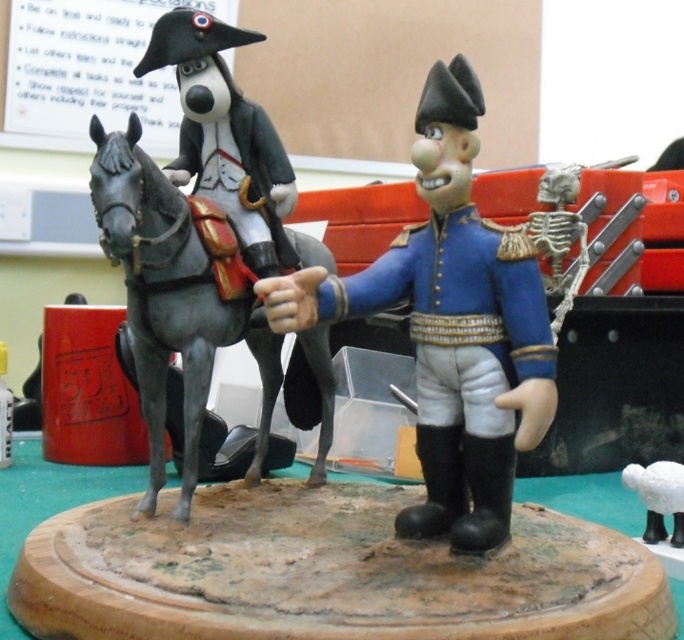
Question: Can you confirm if shiny gray horse at left is positioned above white matte sheep at lower right?

Choices:
 (A) yes
 (B) no

Answer: (A)

Question: Which object appears farthest from the camera in this image?

Choices:
 (A) white matte sheep at lower right
 (B) blue glossy toy soldier at center

Answer: (A)

Question: Is blue glossy toy soldier at center thinner than white matte sheep at lower right?

Choices:
 (A) no
 (B) yes

Answer: (A)

Question: Is shiny gray horse at left bigger than white matte sheep at lower right?

Choices:
 (A) yes
 (B) no

Answer: (A)

Question: Which point appears closest to the camera in this image?

Choices:
 (A) [659, 509]
 (B) [131, 308]

Answer: (B)

Question: Among these objects, which one is farthest from the camera?

Choices:
 (A) white matte sheep at lower right
 (B) shiny gray horse at left
 (C) blue glossy toy soldier at center

Answer: (A)